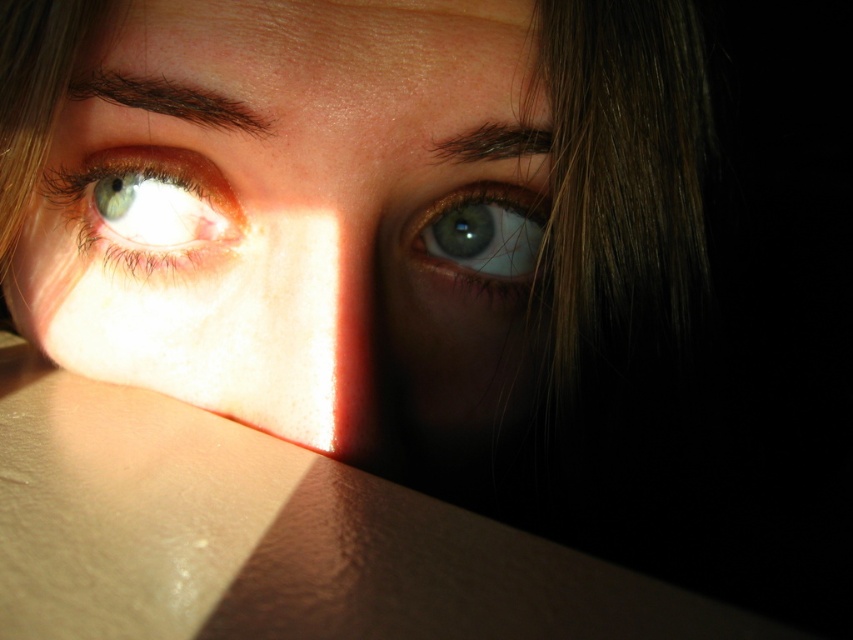
Question: Which point is closer to the camera?

Choices:
 (A) (202, 214)
 (B) (439, 273)

Answer: (A)

Question: Estimate the real-world distances between objects in this image. Which object is farther from the smooth skin face at center?

Choices:
 (A) green glossy eye at upper left
 (B) green iridescent eye at upper center

Answer: (B)

Question: Is smooth skin face at center above green glossy eye at upper left?

Choices:
 (A) no
 (B) yes

Answer: (A)

Question: Can you confirm if green glossy eye at upper left is positioned below green iridescent eye at upper center?

Choices:
 (A) yes
 (B) no

Answer: (B)

Question: Does smooth skin face at center appear under green iridescent eye at upper center?

Choices:
 (A) no
 (B) yes

Answer: (B)

Question: Which point appears farthest from the camera in this image?

Choices:
 (A) (120, 264)
 (B) (521, 0)

Answer: (A)